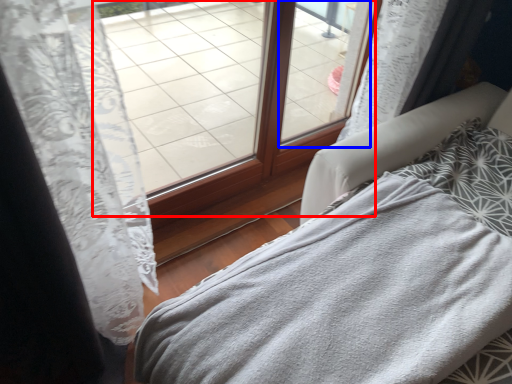
Question: Which point is further to the camera, window (highlighted by a red box) or window (highlighted by a blue box)?

Choices:
 (A) window
 (B) window

Answer: (B)